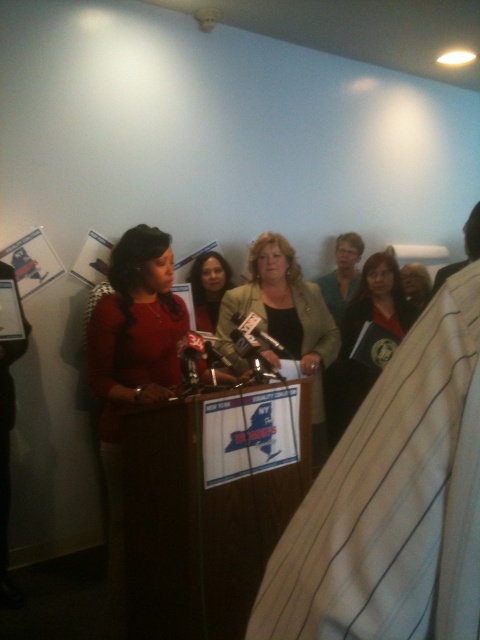
Question: Does matte green blazer at center appear under matte black folder at center?

Choices:
 (A) yes
 (B) no

Answer: (A)

Question: Is matte black hair at center bigger than matte black jacket at center?

Choices:
 (A) yes
 (B) no

Answer: (B)

Question: Which point appears farthest from the camera in this image?

Choices:
 (A) (409, 276)
 (B) (285, 260)
 (C) (204, 288)

Answer: (A)

Question: Estimate the real-world distances between objects in this image. Which object is farther from the matte black jacket at center?

Choices:
 (A) matte black folder at center
 (B) matte green blazer at center
 (C) matte black hair at center

Answer: (C)

Question: Which object appears farthest from the camera in this image?

Choices:
 (A) matte green blazer at center
 (B) matte black folder at center
 (C) matte black hair at center
 (D) matte black jacket at center

Answer: (C)

Question: Considering the relative positions of matte black folder at center and matte black hair at center in the image provided, where is matte black folder at center located with respect to matte black hair at center?

Choices:
 (A) right
 (B) left

Answer: (A)